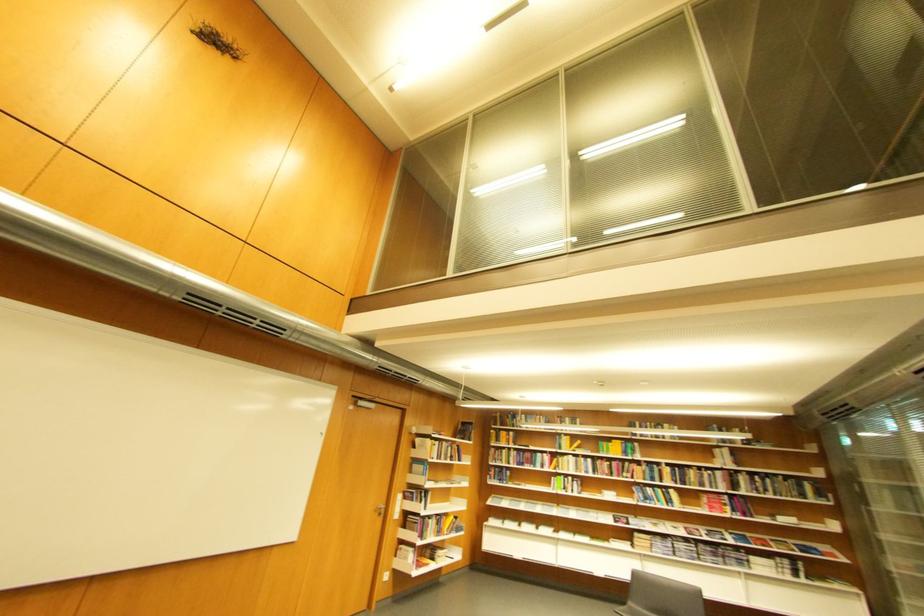
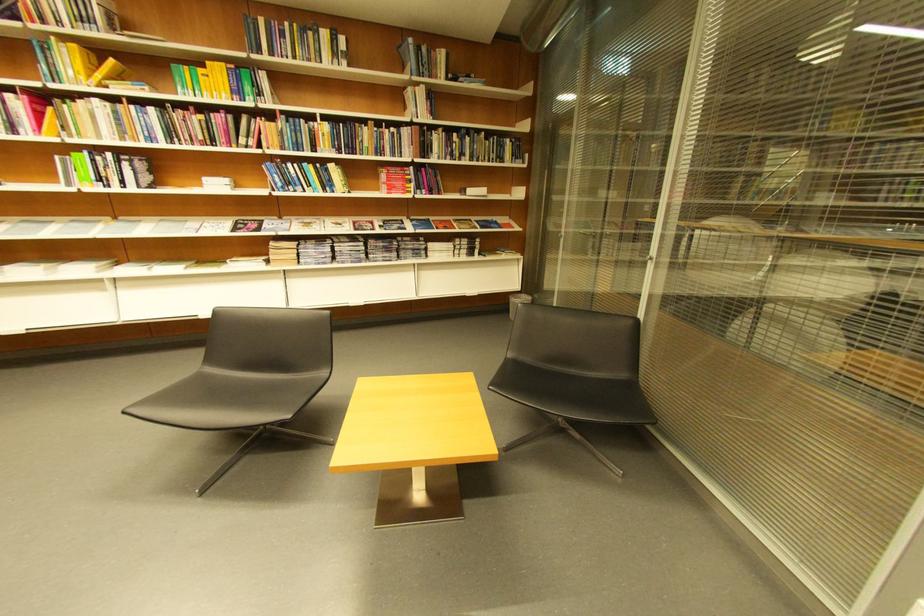
Find the pixel in the second image that matches (x=722, y=498) in the first image.

(403, 172)